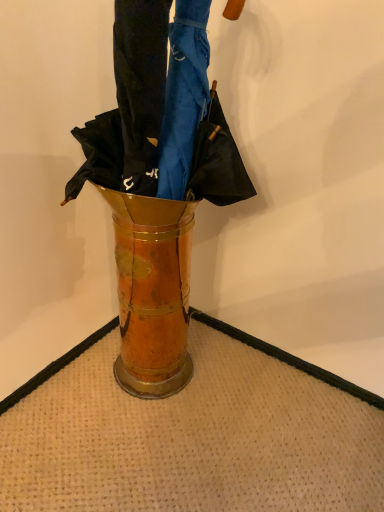
Describe the element at coordinates (152, 292) in the screenshot. I see `gold metallic vase at center` at that location.

The height and width of the screenshot is (512, 384). In order to click on gold metallic vase at center in this screenshot , I will do `click(152, 292)`.

Where is `gold metallic vase at center`? gold metallic vase at center is located at coordinates (152, 292).